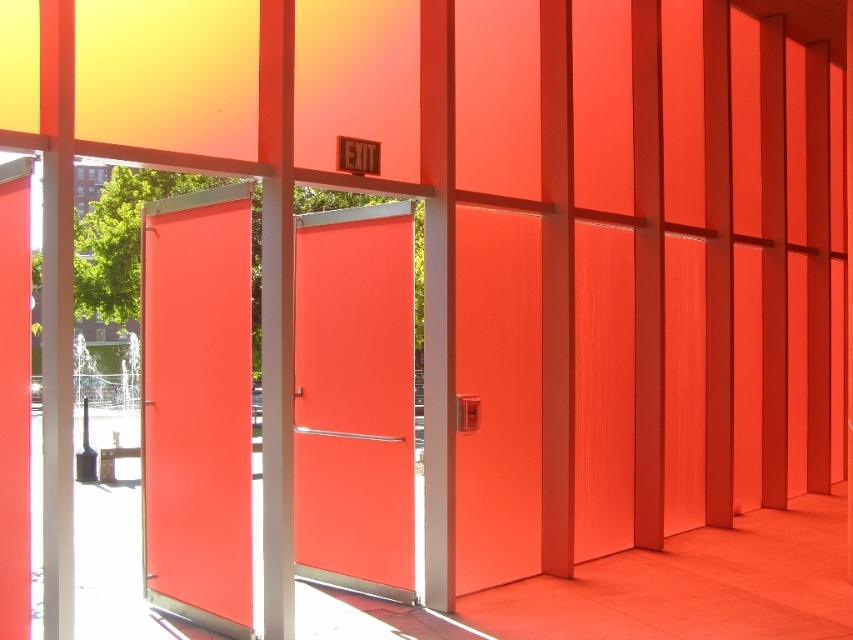
Question: Which is nearer to the matte orange door at center?

Choices:
 (A) satin glass door at left
 (B) matte orange doors at center

Answer: (B)

Question: Is matte orange doors at center to the left of satin glass door at left from the viewer's perspective?

Choices:
 (A) yes
 (B) no

Answer: (B)

Question: Which object is farther from the camera taking this photo?

Choices:
 (A) satin glass door at left
 (B) matte orange doors at center
 (C) matte orange door at center

Answer: (C)

Question: Observing the image, what is the correct spatial positioning of satin glass door at left in reference to matte orange door at center?

Choices:
 (A) above
 (B) below

Answer: (A)

Question: Which of the following is the closest to the observer?

Choices:
 (A) (241, 275)
 (B) (160, 273)
 (C) (376, 326)

Answer: (A)

Question: Is the position of matte orange doors at center more distant than that of matte orange door at center?

Choices:
 (A) yes
 (B) no

Answer: (B)